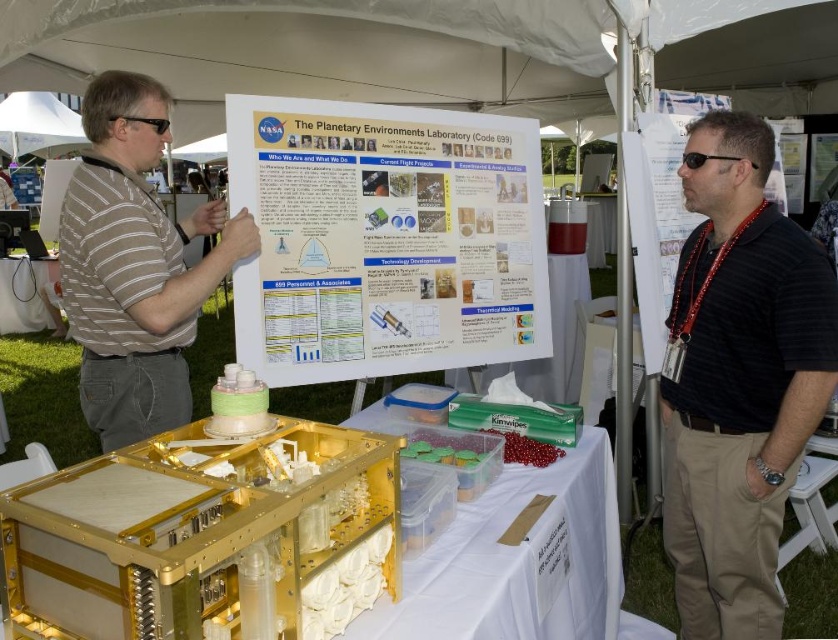
You are a visitor at the science fair booth. You see the white paper at center and the striped cotton shirt at left. Which object is closer to you?

The white paper at center is closer to you because the striped cotton shirt at left is behind it.

You are standing at the center of the booth and notice a golden enclosure on the left side of the table. There is also a white paper at the center. Where is the point marked at coordinates (x=385, y=240) located in relation to these items?

The point marked at coordinates (x=385, y=240) is located on the white paper at center.

You are a visitor at the event and notice two shirts displayed on mannequins at the booth. The black striped shirt at center and the striped cotton shirt at left. Which shirt is located to the right of the other?

The black striped shirt at center is positioned on the right side of the striped cotton shirt at left, so the black striped shirt at center is to the right of the striped cotton shirt at left.